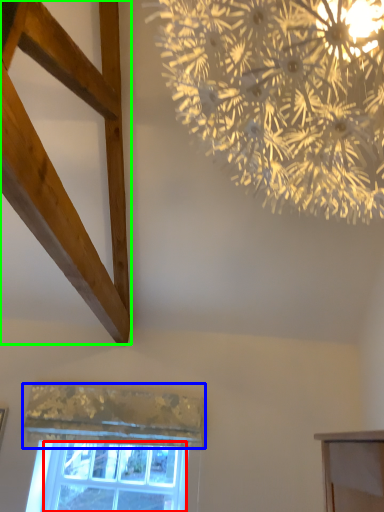
Question: Which object is positioned farthest from window screen (highlighted by a red box)? Select from curtain (highlighted by a blue box) and plank (highlighted by a green box).

Choices:
 (A) curtain
 (B) plank

Answer: (B)